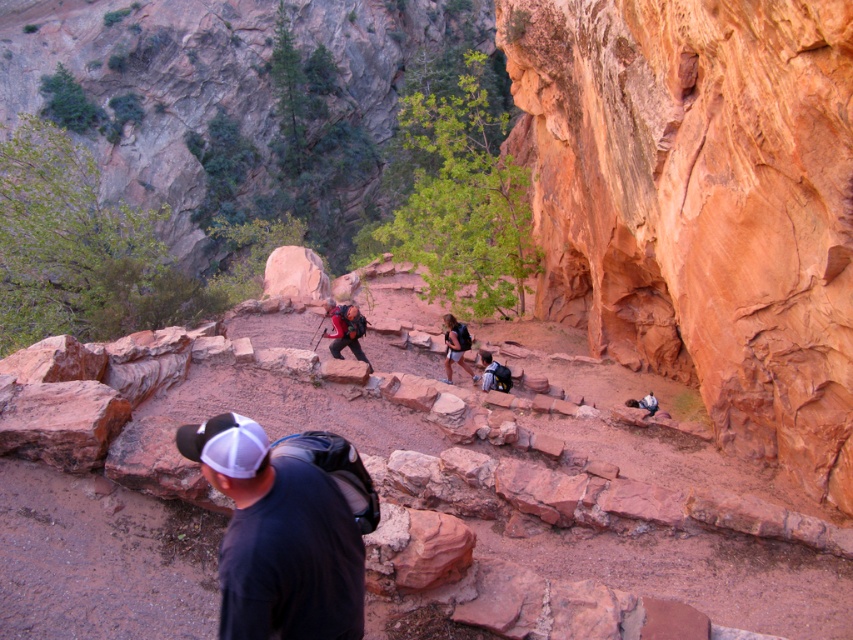
Is point (705, 369) farther from camera compared to point (296, 608)?

That is True.

Is rustic sandstone cliff at right above black fabric backpack at lower center?

Correct, rustic sandstone cliff at right is located above black fabric backpack at lower center.

Where is `rustic sandstone cliff at right`? rustic sandstone cliff at right is located at coordinates (700, 204).

Image resolution: width=853 pixels, height=640 pixels. What are the coordinates of `rustic sandstone cliff at right` in the screenshot? It's located at (700, 204).

Which is in front, point (714, 236) or point (450, 369)?

Point (714, 236)

Locate an element on the screen. The height and width of the screenshot is (640, 853). rustic sandstone cliff at right is located at coordinates (700, 204).

Which is in front, point (271, 598) or point (453, 328)?

Positioned in front is point (271, 598).

Can you confirm if black fabric backpack at lower center is thinner than matte black backpack at center?

In fact, black fabric backpack at lower center might be wider than matte black backpack at center.

Does point (225, 580) lie behind point (445, 380)?

That is False.

You are a GUI agent. You are given a task and a screenshot of the screen. Output one action in this format:
    pyautogui.click(x=<x>, y=<y>)
    Task: Click on the black fabric backpack at lower center
    This screenshot has height=640, width=853.
    Given the screenshot: What is the action you would take?
    pyautogui.click(x=277, y=538)